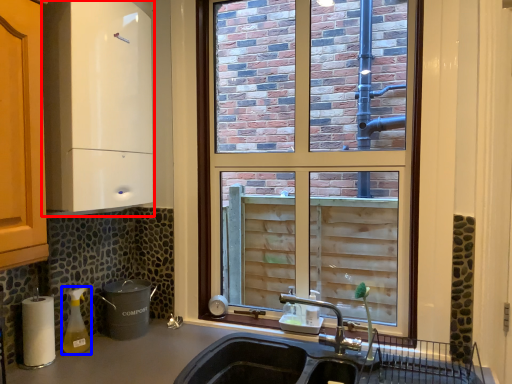
Question: Among these objects, which one is farthest to the camera, appliance (highlighted by a red box) or bottle (highlighted by a blue box)?

Choices:
 (A) appliance
 (B) bottle

Answer: (B)